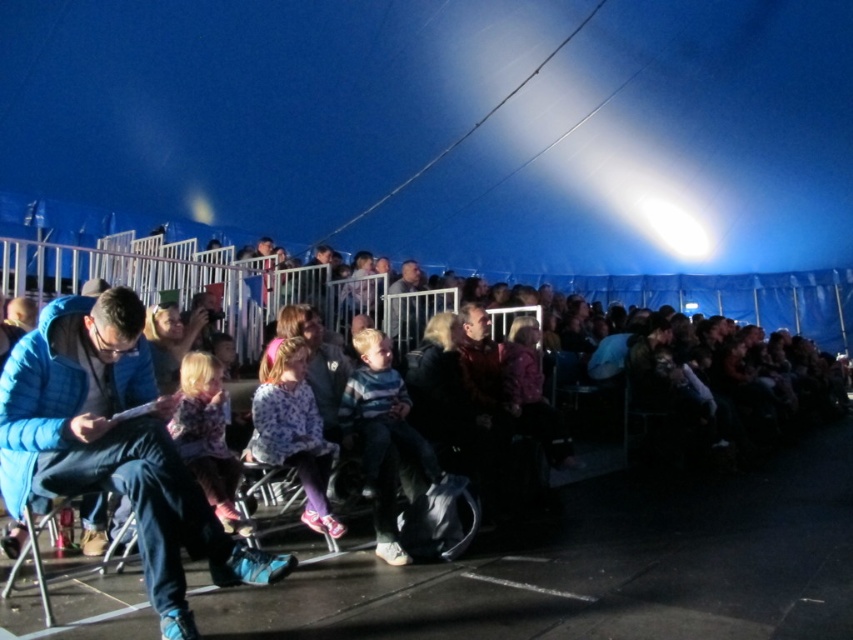
Question: Considering the relative positions of matte blue jacket at center and fluffy pink dress at center in the image provided, where is matte blue jacket at center located with respect to fluffy pink dress at center?

Choices:
 (A) below
 (B) above

Answer: (A)

Question: Which of the following is the closest to the observer?

Choices:
 (A) (154, 499)
 (B) (334, 528)
 (C) (186, 403)

Answer: (A)

Question: Which point appears farthest from the camera in this image?

Choices:
 (A) (196, 368)
 (B) (291, 394)

Answer: (B)

Question: Can you confirm if floral sweater at center is thinner than fluffy pink dress at center?

Choices:
 (A) yes
 (B) no

Answer: (B)

Question: Can you confirm if floral sweater at center is positioned below fluffy pink dress at center?

Choices:
 (A) no
 (B) yes

Answer: (B)

Question: Estimate the real-world distances between objects in this image. Which object is closer to the fluffy pink dress at center?

Choices:
 (A) matte blue jacket at center
 (B) floral sweater at center

Answer: (B)